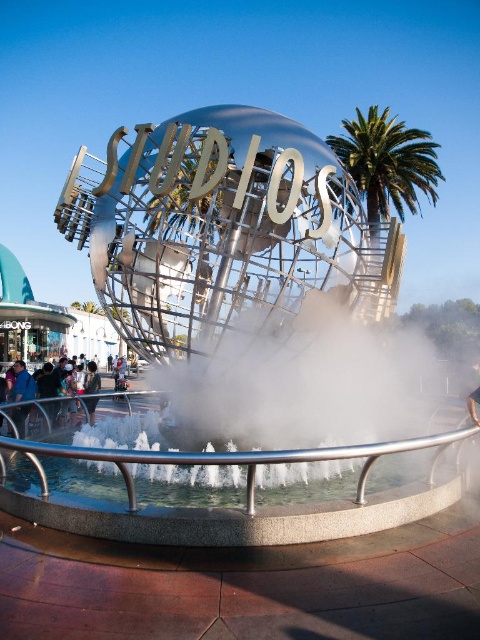
Question: Which of the following is the closest to the observer?

Choices:
 (A) (98, 378)
 (B) (380, 189)
 (C) (332, 244)
 (D) (28, 388)

Answer: (C)

Question: Does metallic sphere at center appear under dark blue jeans at lower left?

Choices:
 (A) no
 (B) yes

Answer: (A)

Question: Which of the following is the closest to the observer?

Choices:
 (A) (215, 188)
 (B) (49, 365)
 (C) (423, 145)
 (D) (20, 365)

Answer: (A)

Question: Does green leafy palm tree at upper right have a greater width compared to dark blue jeans at lower left?

Choices:
 (A) no
 (B) yes

Answer: (B)

Question: Which of these objects is positioned farthest from the blue fabric shirt at lower left?

Choices:
 (A) metallic sphere at center
 (B) green leafy palm tree at upper right

Answer: (B)

Question: In this image, where is green leafy palm tree at upper right located relative to blue fabric shirt at lower left?

Choices:
 (A) left
 (B) right

Answer: (B)